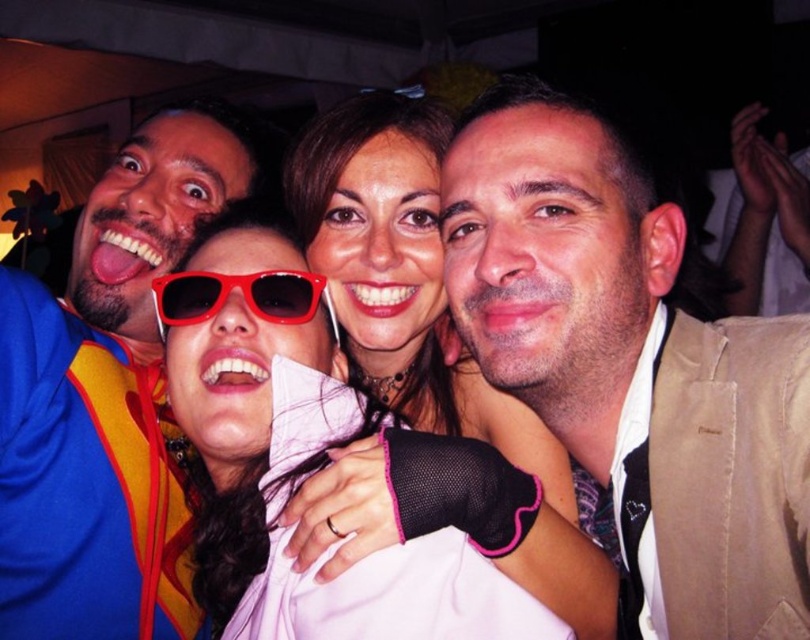
Is point (301, 435) closer to camera compared to point (301, 273)?

Yes, it is in front of point (301, 273).

The height and width of the screenshot is (640, 810). Find the location of `matte plastic sunglasses at center`. matte plastic sunglasses at center is located at coordinates (244, 392).

Is point (431, 564) closer to viewer compared to point (194, 321)?

Yes, point (431, 564) is in front of point (194, 321).

The width and height of the screenshot is (810, 640). Find the location of `matte plastic sunglasses at center`. matte plastic sunglasses at center is located at coordinates (244, 392).

Can you confirm if beige textured jacket at upper right is positioned to the left of red plastic sunglasses at center?

Incorrect, beige textured jacket at upper right is not on the left side of red plastic sunglasses at center.

Locate an element on the screen. The width and height of the screenshot is (810, 640). beige textured jacket at upper right is located at coordinates (632, 365).

How distant is blue fleece jacket at upper left from matte plastic sunglasses at center?

They are 7.24 inches apart.

Between blue fleece jacket at upper left and matte plastic sunglasses at center, which one is positioned lower?

matte plastic sunglasses at center

Between point (114, 477) and point (227, 248), which one is positioned behind?

The point (114, 477) is more distant.

This screenshot has height=640, width=810. What are the coordinates of `blue fleece jacket at upper left` in the screenshot? It's located at (105, 396).